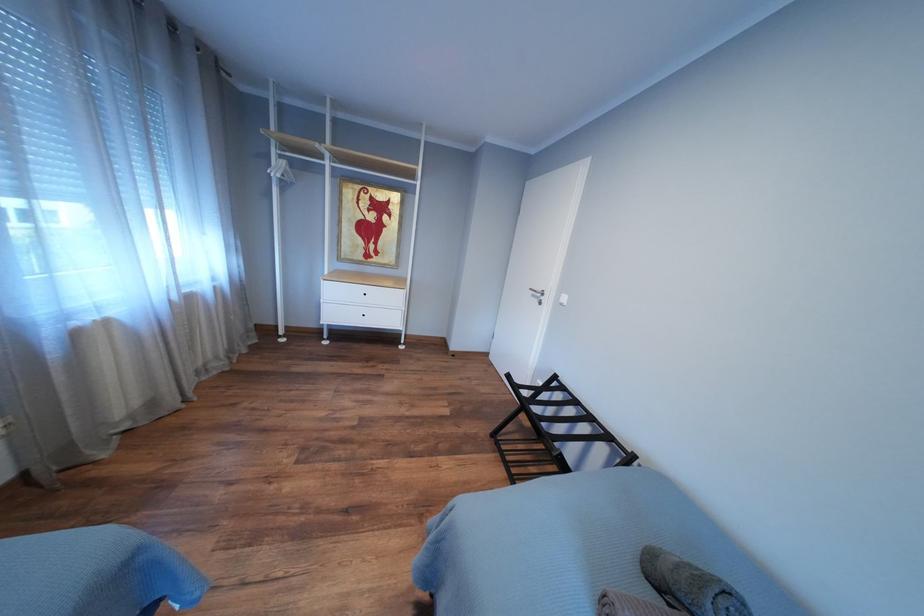
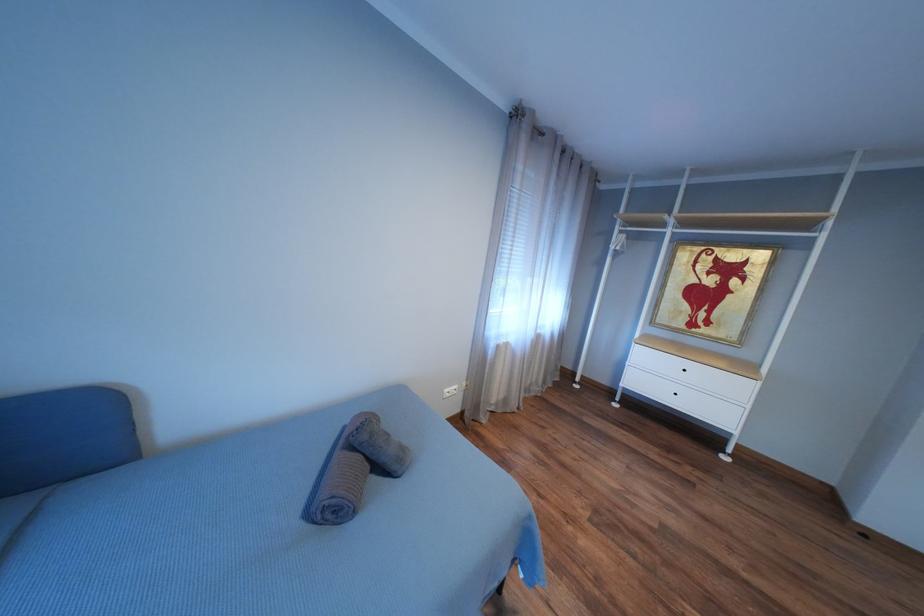
Question: How did the camera likely rotate?

Choices:
 (A) Left
 (B) Right
 (C) Up
 (D) Down

Answer: (A)